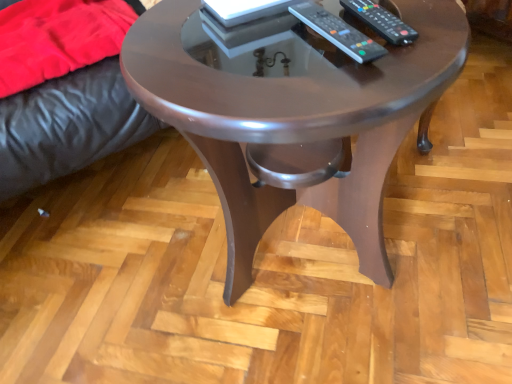
You are a GUI agent. You are given a task and a screenshot of the screen. Output one action in this format:
    pyautogui.click(x=<x>, y=<y>)
    Task: Click on the vacant space that is to the left of shiny brown wood coffee table at center
    The image size is (512, 384).
    Given the screenshot: What is the action you would take?
    pyautogui.click(x=116, y=286)